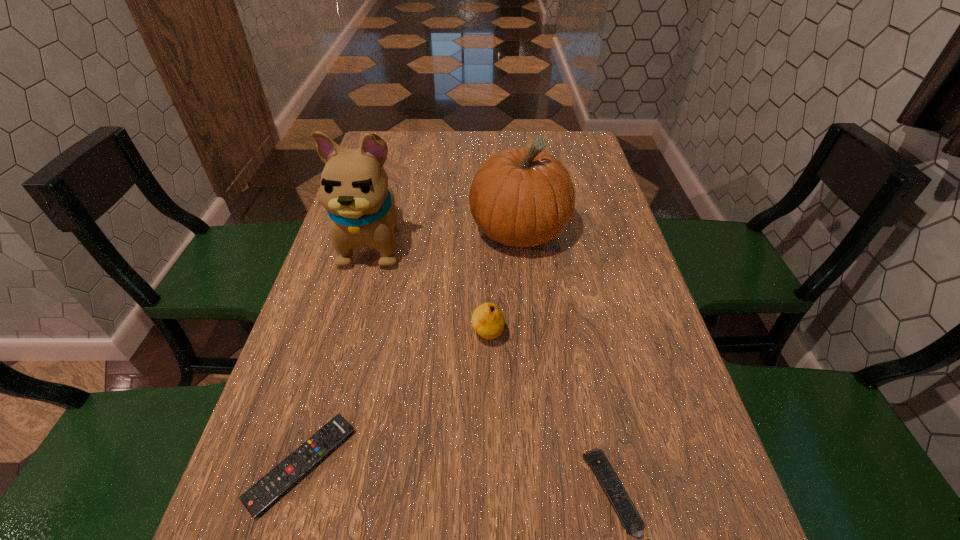
Locate an element on the screen. vacant space that is in between the pumpkin and the taller remote control is located at coordinates click(x=565, y=362).

Identify the location of vacant space in between the taller remote control and the left remote control. The image size is (960, 540). (456, 478).

Where is `the closest object to the pear`? the closest object to the pear is located at coordinates pos(520,197).

Locate an element on the screen. object that stands as the closest to the left remote control is located at coordinates (488, 321).

The image size is (960, 540). Find the location of `free space that satisfies the following two spatial constraints: 1. on the face of the pear; 2. on the left side of the puppy`. free space that satisfies the following two spatial constraints: 1. on the face of the pear; 2. on the left side of the puppy is located at coordinates (349, 335).

Locate an element on the screen. The height and width of the screenshot is (540, 960). free location that satisfies the following two spatial constraints: 1. on the face of the tallest object; 2. on the left side of the second shortest object is located at coordinates (307, 491).